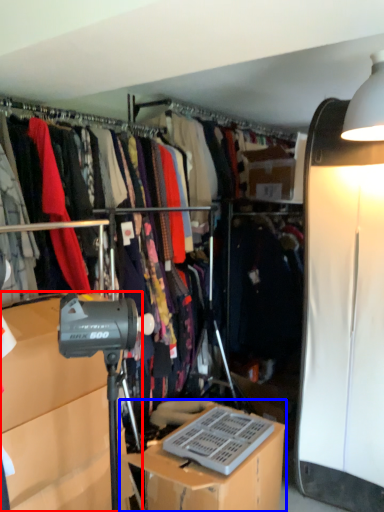
Question: Which object is closer to the camera taking this photo, cabinetry (highlighted by a red box) or desk (highlighted by a blue box)?

Choices:
 (A) cabinetry
 (B) desk

Answer: (A)